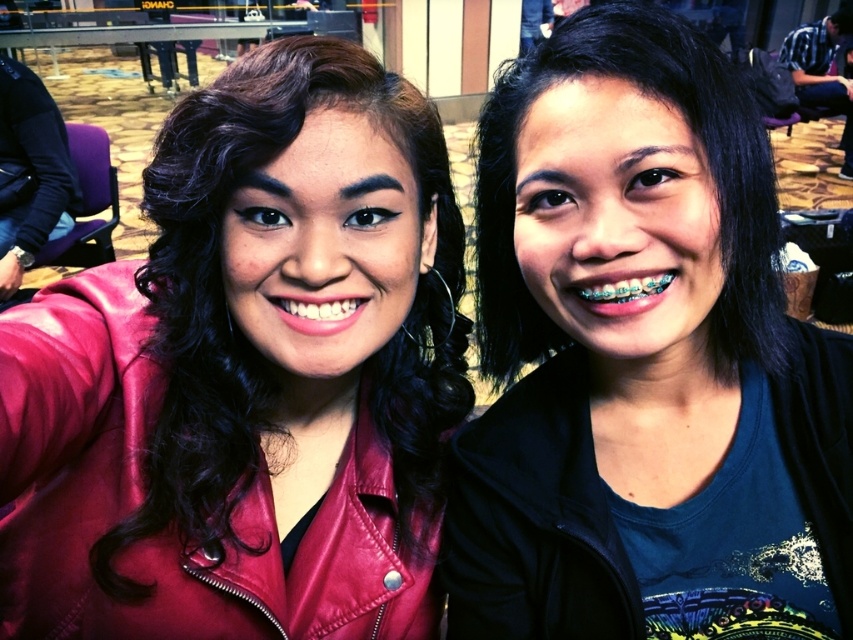
Question: Is matte leather jacket at left to the right of white glossy teeth at center from the viewer's perspective?

Choices:
 (A) yes
 (B) no

Answer: (B)

Question: Is the position of matte leather jacket at left less distant than that of teethmetallicmouth at right?

Choices:
 (A) no
 (B) yes

Answer: (B)

Question: Which of the following is the closest to the observer?

Choices:
 (A) matte leather jacket at left
 (B) blue matte shirt at center

Answer: (A)

Question: Can you confirm if matte leather jacket at left is wider than teethmetallicmouth at right?

Choices:
 (A) yes
 (B) no

Answer: (A)

Question: Which object is the closest to the blue matte shirt at center?

Choices:
 (A) white glossy teeth at center
 (B) matte leather jacket at left

Answer: (B)

Question: Among these objects, which one is nearest to the camera?

Choices:
 (A) blue matte shirt at center
 (B) teethmetallicmouth at right
 (C) white glossy teeth at center

Answer: (A)